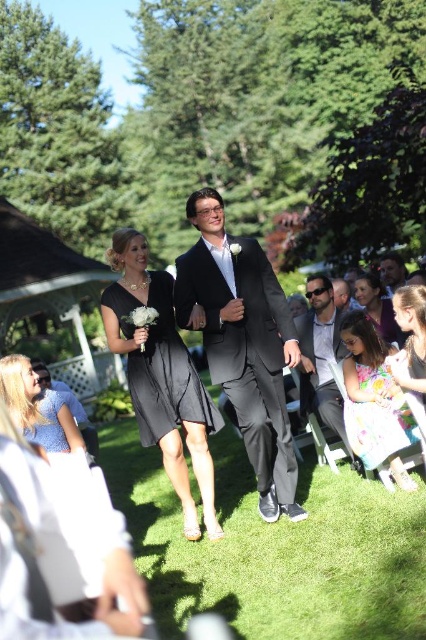
Question: Which object is positioned closest to the shiny black suit at center?

Choices:
 (A) floral chiffon dress at lower right
 (B) black satin dress at center
 (C) brown leather jacket at lower right
 (D) silky floral dress at lower right

Answer: (B)

Question: Can you confirm if floral chiffon dress at lower right is wider than brown leather jacket at lower right?

Choices:
 (A) yes
 (B) no

Answer: (A)

Question: Which point is farther to the camera?

Choices:
 (A) smooth gray suit at center
 (B) matte black suit at center
 (C) floral chiffon dress at lower right
 (D) shiny black suit at center

Answer: (A)

Question: Does matte black dress at lower right have a greater width compared to smooth gray suit at center?

Choices:
 (A) yes
 (B) no

Answer: (B)

Question: Does shiny black suit at center appear on the right side of matte black dress at lower right?

Choices:
 (A) no
 (B) yes

Answer: (A)

Question: Which of the following is the closest to the observer?

Choices:
 (A) black satin dress at center
 (B) shiny black suit at center

Answer: (B)